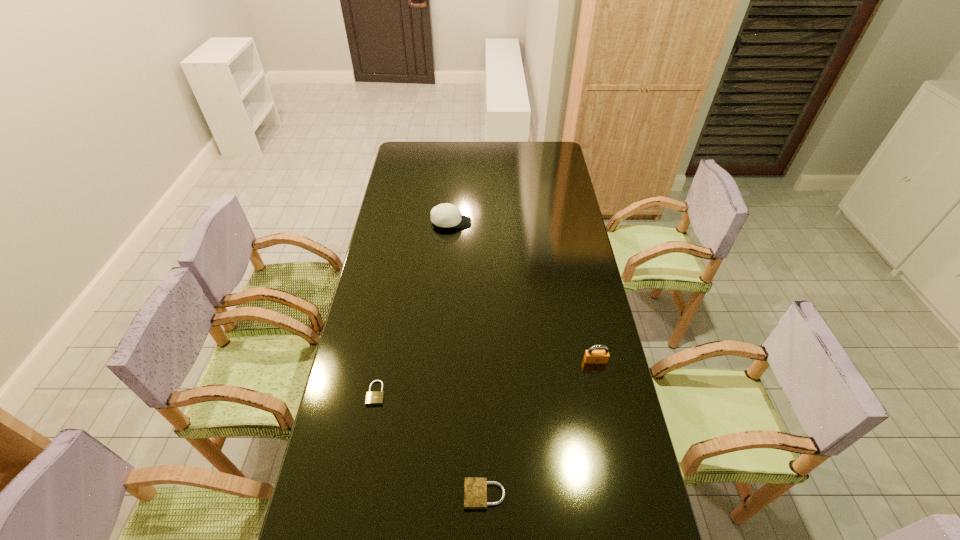
Where is `baseball cap`? baseball cap is located at coordinates (443, 215).

Find the location of a particular element. the third nearest object is located at coordinates (591, 356).

Where is `the tallest padlock`? The image size is (960, 540). the tallest padlock is located at coordinates (591, 356).

At what (x,y) coordinates should I click in order to perform the action: click on the second tallest padlock. Please return your answer as a coordinate pair (x, y). The width and height of the screenshot is (960, 540). Looking at the image, I should click on (475, 488).

Identify the location of the second padlock from left to right. The image size is (960, 540). (475, 488).

In order to click on the leftmost padlock in this screenshot , I will do `click(372, 398)`.

This screenshot has height=540, width=960. I want to click on the second farthest padlock, so click(372, 398).

The width and height of the screenshot is (960, 540). I want to click on free region located 0.280m on the front-facing side of the farthest object, so click(x=535, y=222).

This screenshot has width=960, height=540. Find the location of `vacant region located 0.370m to unlock the rightmost padlock from the front`. vacant region located 0.370m to unlock the rightmost padlock from the front is located at coordinates click(x=621, y=483).

The image size is (960, 540). What are the coordinates of `vacant space located on the keyhole side of the second shortest padlock` in the screenshot? It's located at (343, 495).